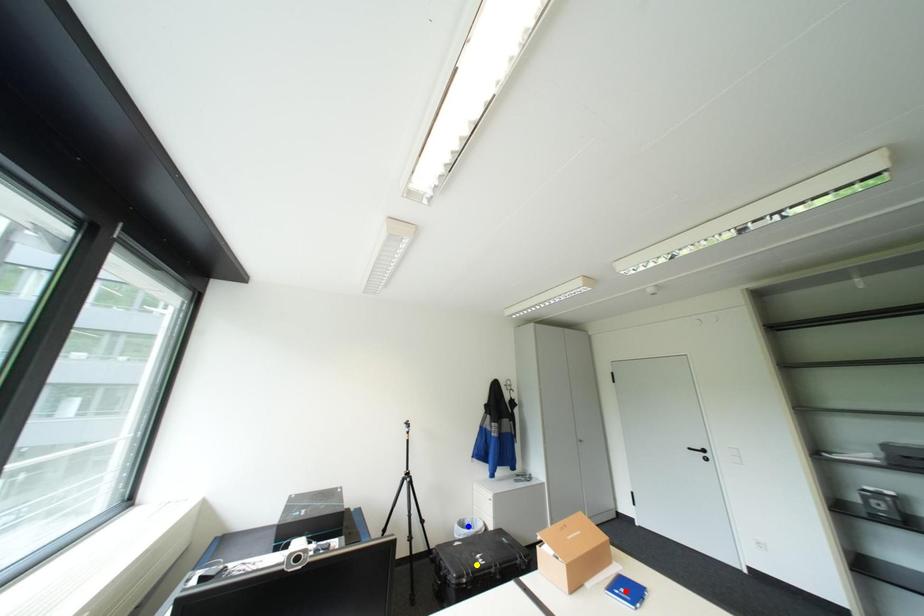
Looking at this image, order these from nearest to farthest:
- blue point
- red point
- yellow point

red point
yellow point
blue point